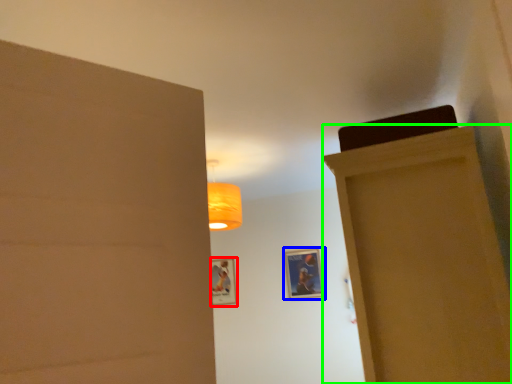
Question: Which is farther away from picture frame (highlighted by a red box)? picture frame (highlighted by a blue box) or door (highlighted by a green box)?

Choices:
 (A) picture frame
 (B) door

Answer: (B)